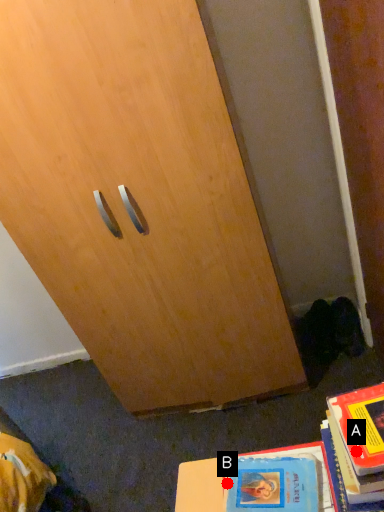
Question: Two points are circled on the image, labeled by A and B beside each circle. Which point is further to the camera?

Choices:
 (A) A is further
 (B) B is further

Answer: (B)